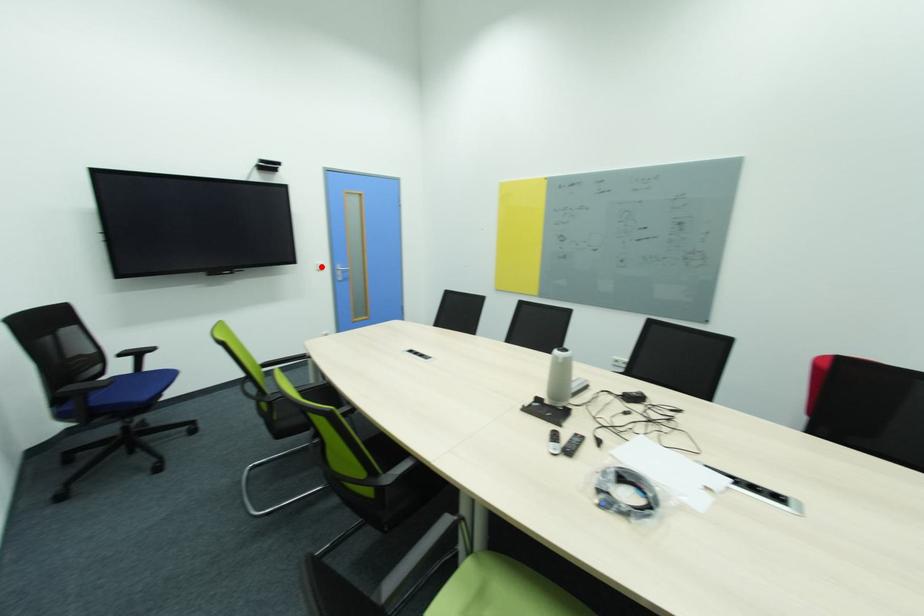
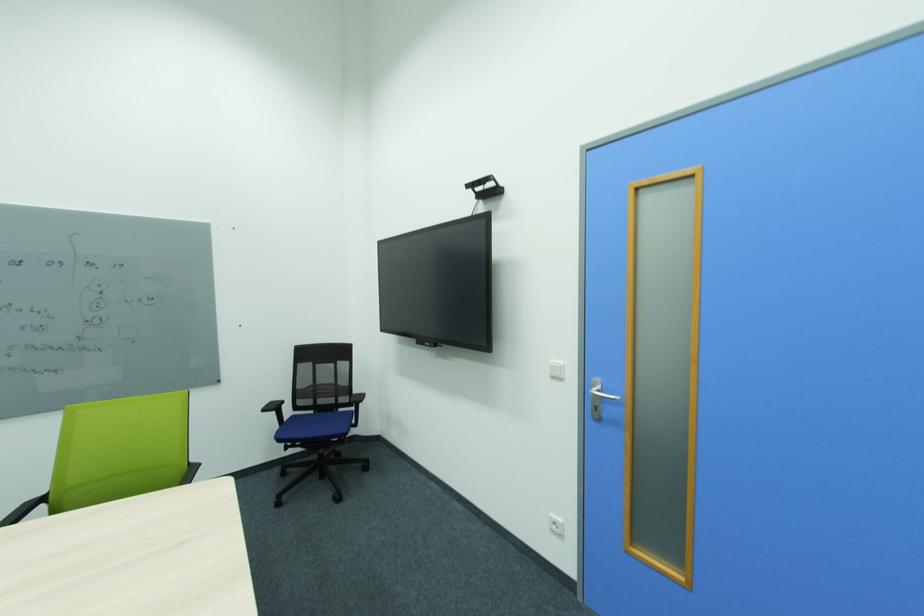
Question: I am providing you with two images of the same scene from different viewpoints. In image1, a red point is highlighted. Considering the same 3D point in image2, which of the following is correct?

Choices:
 (A) It is closer
 (B) It is farther

Answer: (B)